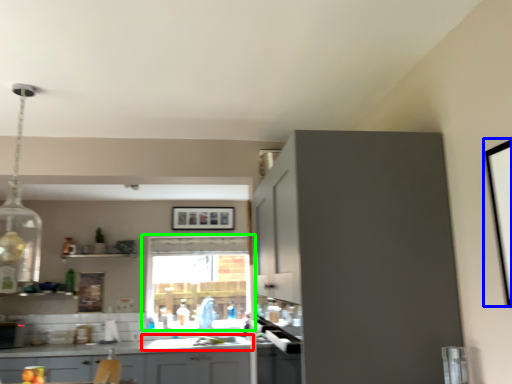
Question: Based on their relative distances, which object is nearer to sink (highlighted by a red box)? Choose from picture frame (highlighted by a blue box) and window (highlighted by a green box).

Choices:
 (A) picture frame
 (B) window

Answer: (B)